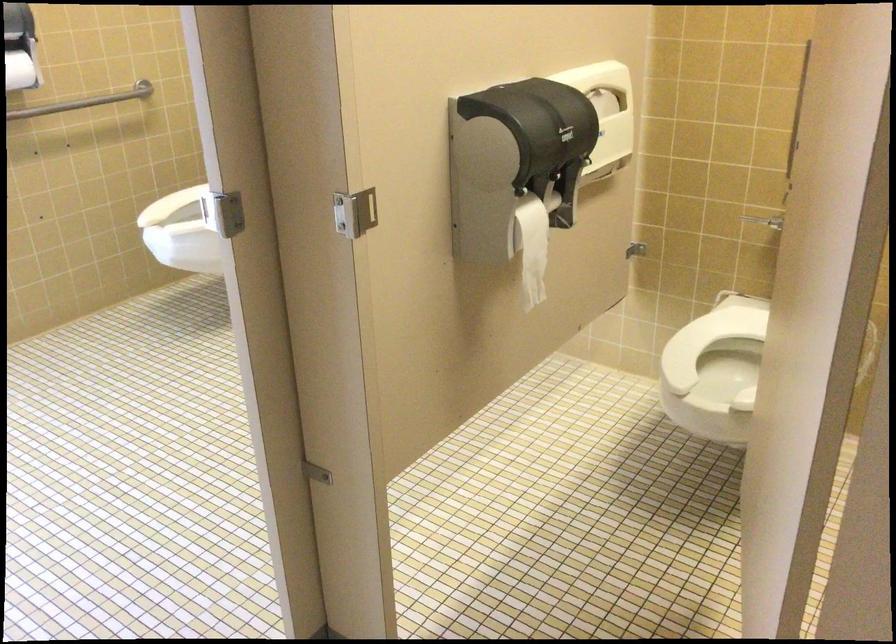
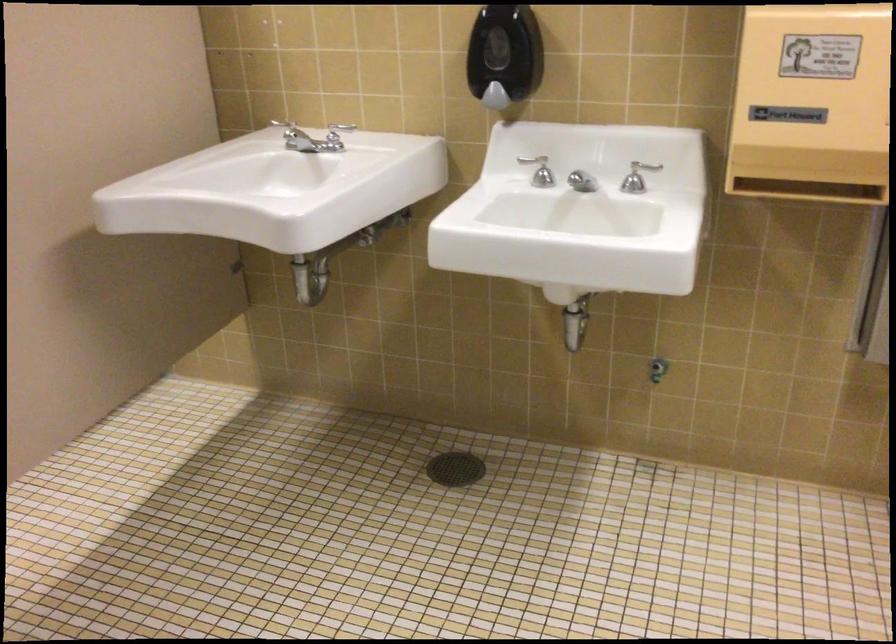
In a continuous first-person perspective shot, in which direction is the camera moving?

The movement direction of the cameraman is right, backward.